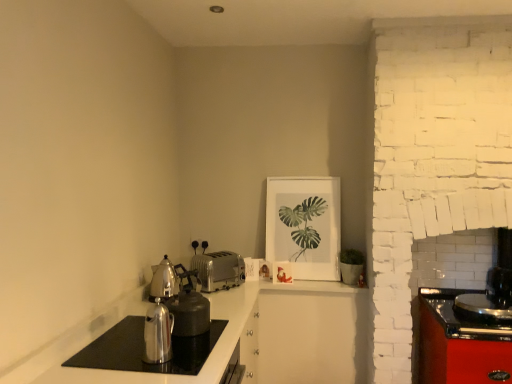
This screenshot has width=512, height=384. Identify the location of vacant region to the right of shiny metallic kettle at lower left. (189, 364).